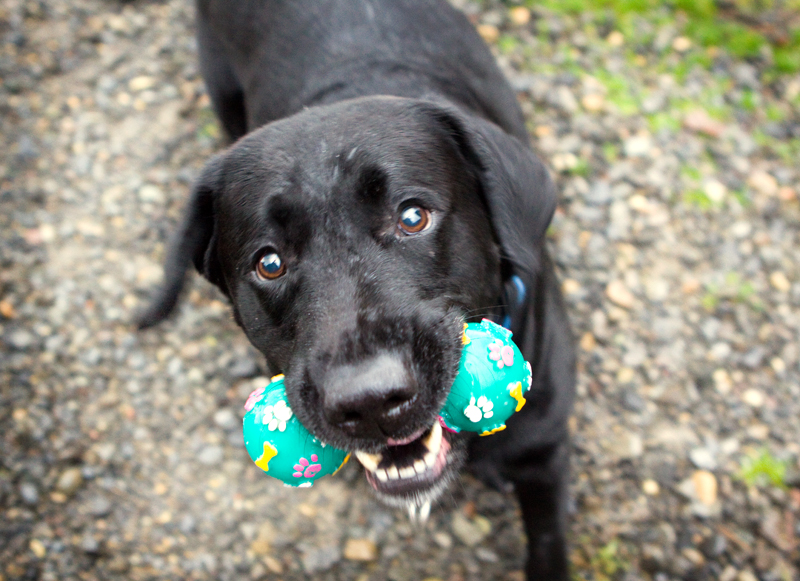
Find the location of `toy`. toy is located at coordinates (490, 371).